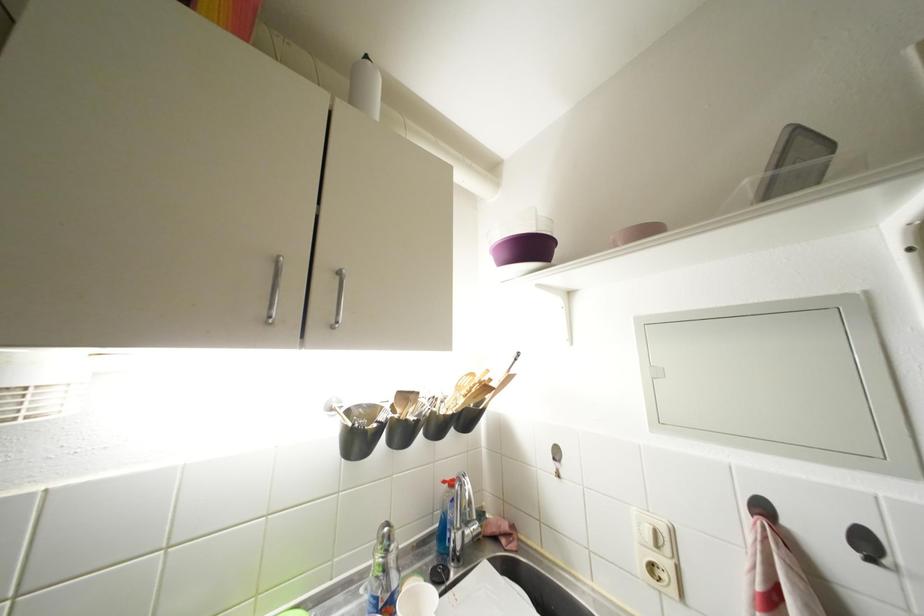
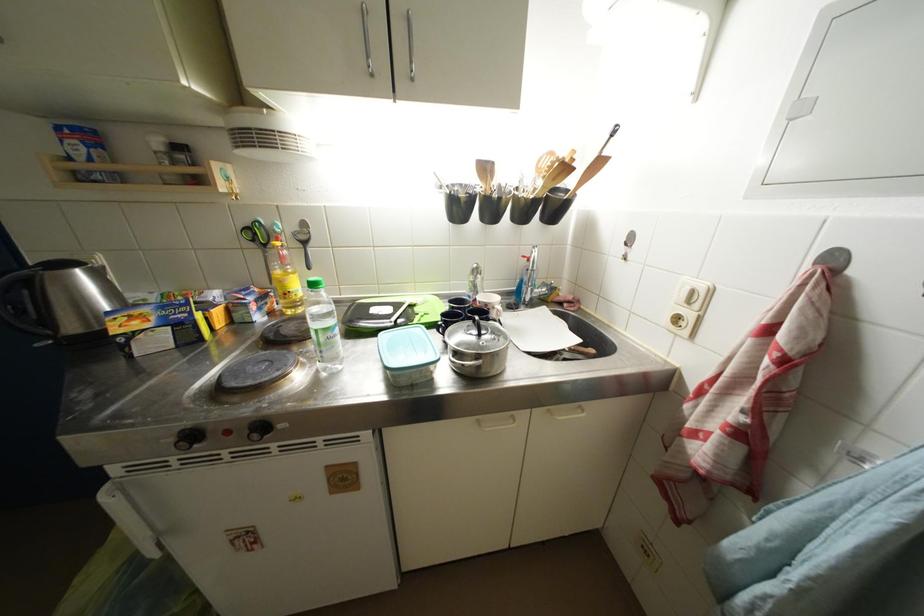
Locate, in the second image, the point that corresponds to [412,400] in the first image.

(492, 172)